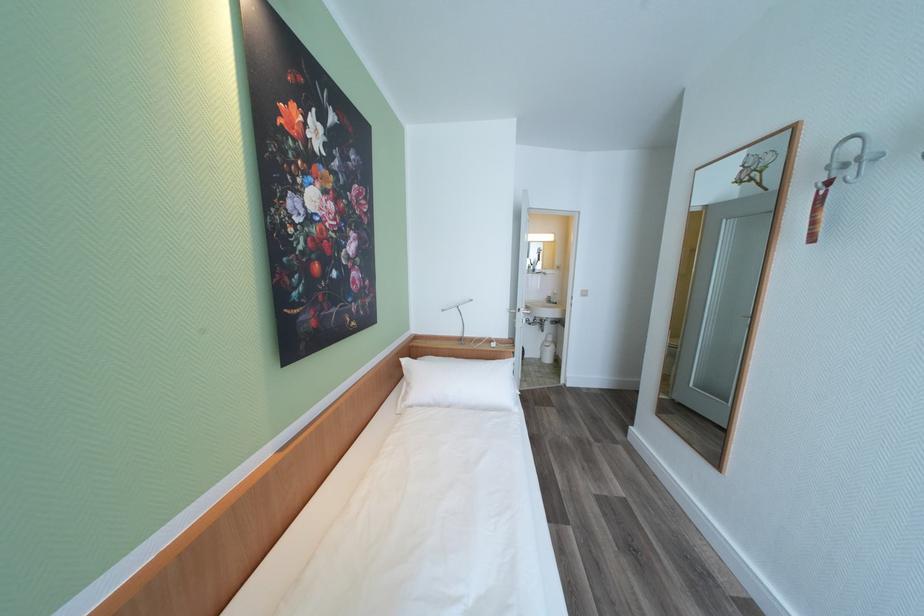
Find where to lift the faucet handle. Please return your answer as a coordinate pair (x, y).

(552, 297)